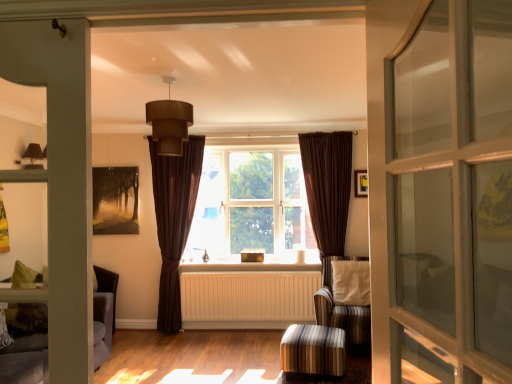
The width and height of the screenshot is (512, 384). Identify the location of vacant area on top of matte brown lampshade at upper center (from a real-world perspective). (167, 79).